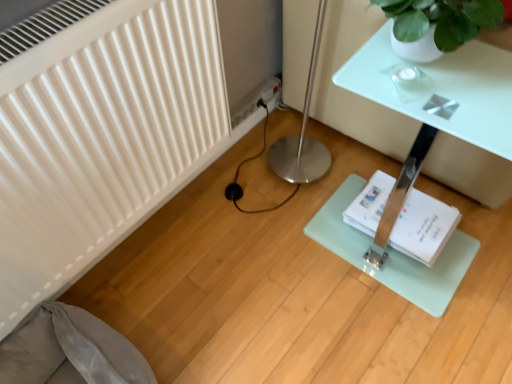
Find the location of a particular element. This screenshot has width=512, height=384. unoccupied region to the right of gray fabric swivel chair at lower left is located at coordinates (225, 333).